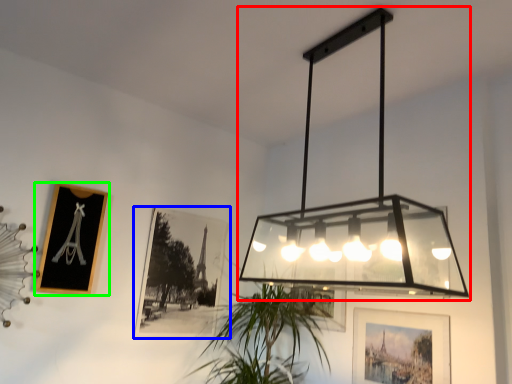
Question: Considering the real-world distances, which object is farthest from lamp (highlighted by a red box)? picture frame (highlighted by a blue box) or picture frame (highlighted by a green box)?

Choices:
 (A) picture frame
 (B) picture frame

Answer: (B)